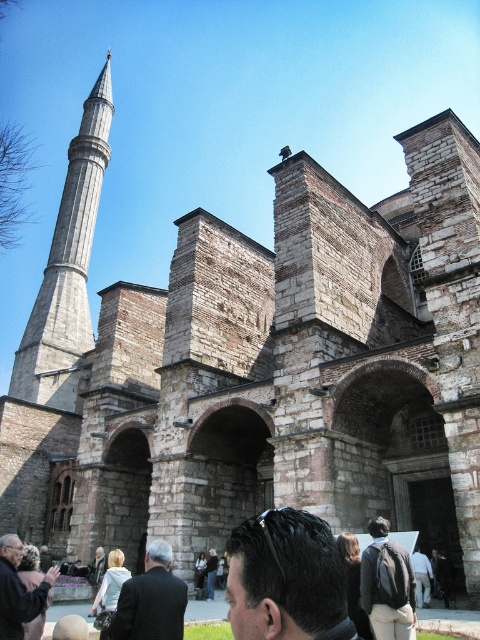
You are a tourist visiting the historic stone structure. You notice the gray stone minaret at left and the dark brown leather jacket at lower left. Which object is larger in size?

The gray stone minaret at left is bigger than the dark brown leather jacket at lower left according to the description.

You are standing at a distance of 500 feet away from the historic stone mosque. There is a point marked at coordinates point [59,300]. Can you walk towards the mosque and reach that point?

The distance of point [59,300] from viewer is 465.47 feet, so yes, you can walk towards the mosque and reach that point since it is within your current distance of 500 feet.

You are a photographer standing in front of the historic stone structure. You notice a point marked at coordinates [286,579]. What is located at that point?

The point at coordinates [286,579] indicates dark brown hair at center.